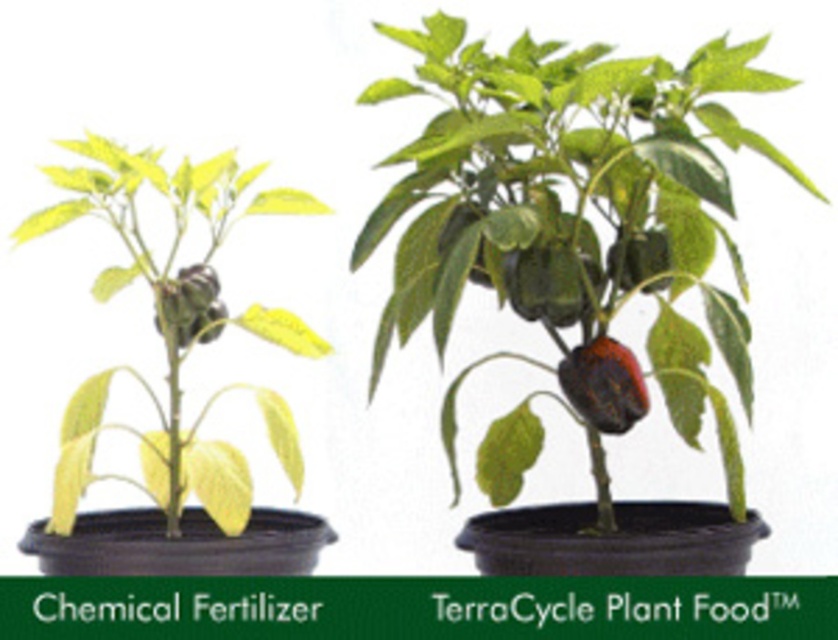
Question: Where is green matte pepper at center located in relation to yellow matte leafy plant at left in the image?

Choices:
 (A) below
 (B) above

Answer: (B)

Question: Which point is farther to the camera?

Choices:
 (A) (635, 282)
 (B) (198, 330)
 (C) (198, 461)
 (D) (617, 392)

Answer: (B)

Question: Can you confirm if yellow matte leafy plant at left is bigger than green matte pepper at upper center?

Choices:
 (A) no
 (B) yes

Answer: (B)

Question: Is yellow matte leafy plant at left to the right of green matte pepper at upper center from the viewer's perspective?

Choices:
 (A) yes
 (B) no

Answer: (B)

Question: Which object is positioned closest to the green matte pepper at center?

Choices:
 (A) green matte pepper at left
 (B) yellow matte leafy plant at left

Answer: (B)

Question: Which of the following is the closest to the observer?

Choices:
 (A) shiny dark red pepper at center
 (B) green matte pepper at upper center
 (C) green matte pepper at left
 (D) yellow matte leafy plant at left

Answer: (D)